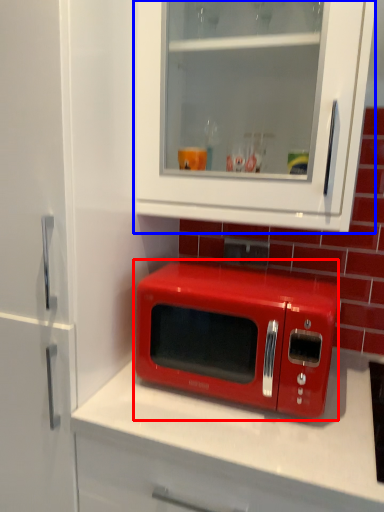
Question: Which of the following is the closest to the observer, microwave oven (highlighted by a red box) or cabinetry (highlighted by a blue box)?

Choices:
 (A) microwave oven
 (B) cabinetry

Answer: (B)